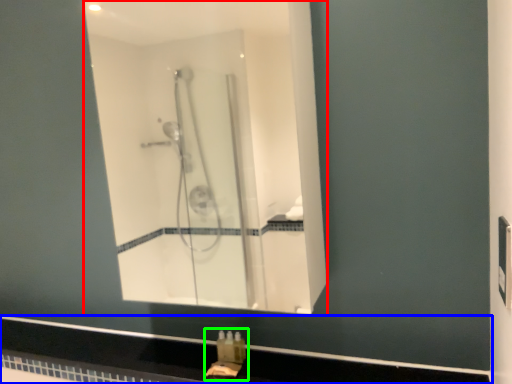
Question: Based on their relative distances, which object is farther from mirror (highlighted by a red box)? Choose from counter top (highlighted by a blue box) and sink (highlighted by a green box).

Choices:
 (A) counter top
 (B) sink

Answer: (B)